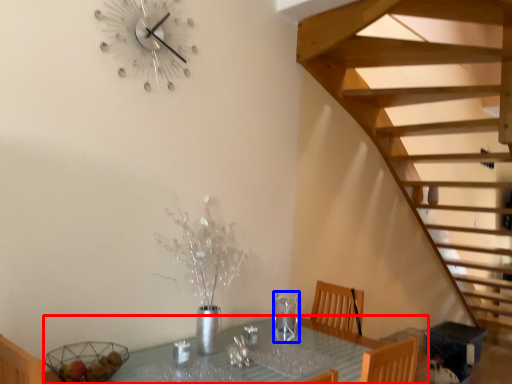
Question: Which point is further to the camera, table (highlighted by a red box) or wine glass (highlighted by a blue box)?

Choices:
 (A) table
 (B) wine glass

Answer: (B)